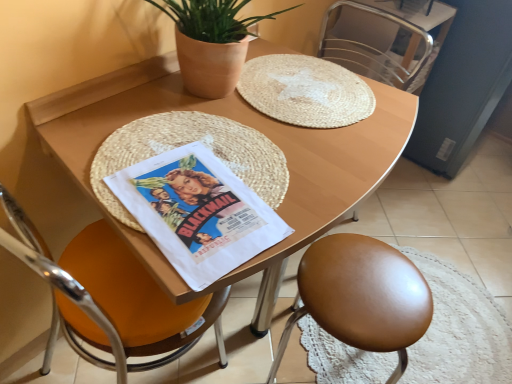
Question: Is point (201, 261) positioned closer to the camera than point (96, 221)?

Choices:
 (A) farther
 (B) closer

Answer: (B)

Question: Considering the positions of white paper comic book at center and orange leather chair at left, the third chair positioned from the right, in the image, is white paper comic book at center wider or thinner than orange leather chair at left, the third chair positioned from the right,?

Choices:
 (A) thin
 (B) wide

Answer: (A)

Question: Estimate the real-world distances between objects in this image. Which object is farther from the brown leather stool at lower right, which is the 2th chair in right-to-left order?

Choices:
 (A) orange leather chair at left, the 1th chair from the left
 (B) wooden table at center
 (C) terracotta pot at upper center
 (D) white paper comic book at center
 (E) metallic silver chair at upper right, the third chair from the left

Answer: (E)

Question: Which object is positioned closest to the wooden table at center?

Choices:
 (A) brown leather stool at lower right, the 2th chair positioned from the left
 (B) white paper comic book at center
 (C) metallic silver chair at upper right, the third chair from the left
 (D) orange leather chair at left, the third chair positioned from the right
 (E) terracotta pot at upper center

Answer: (B)